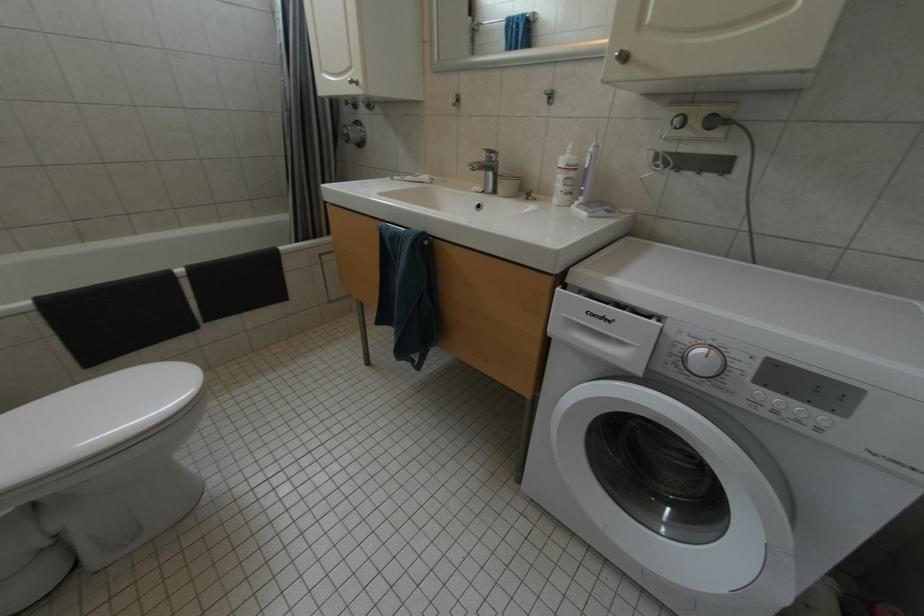
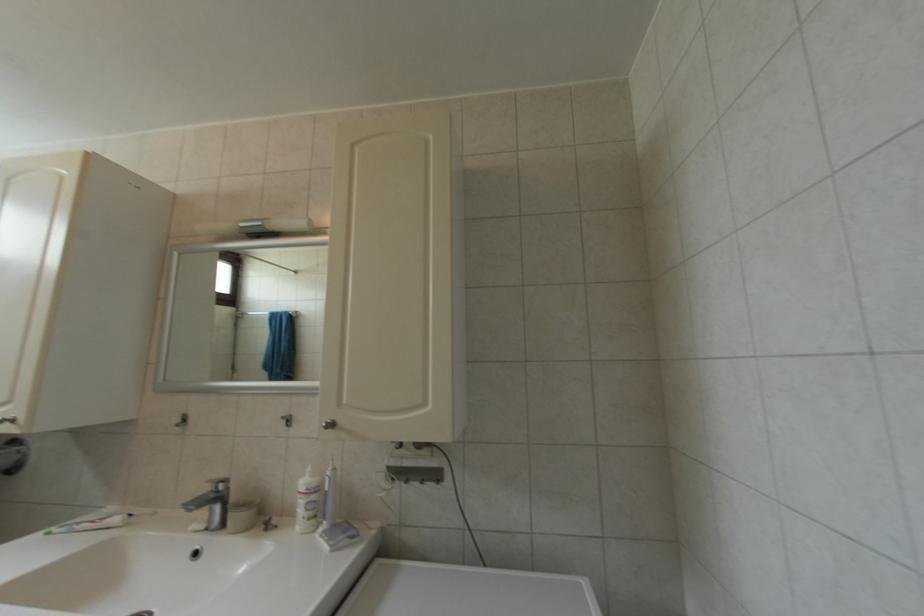
The first image is from the beginning of the video and the second image is from the end. How did the camera likely rotate when shooting the video?

The camera's rotation is toward right-up.